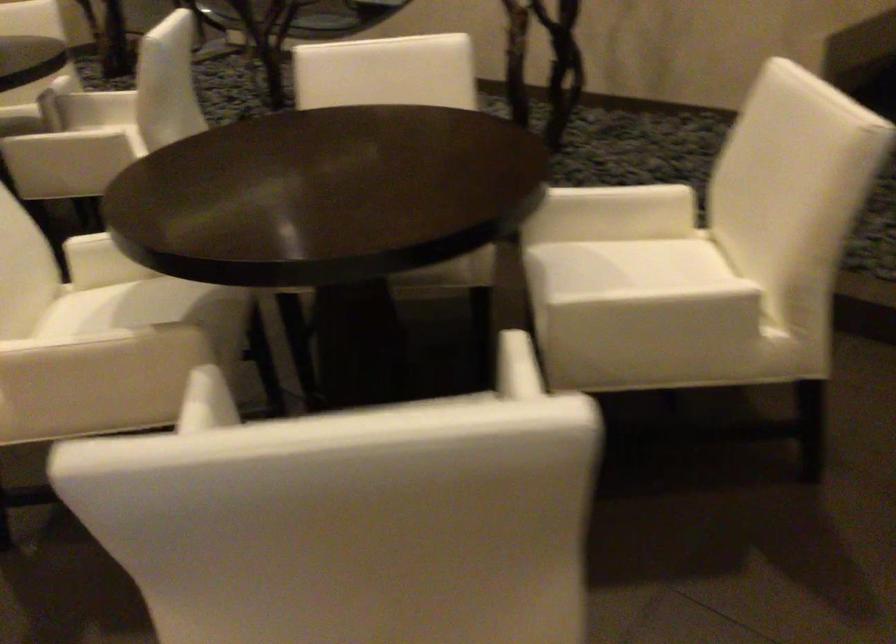
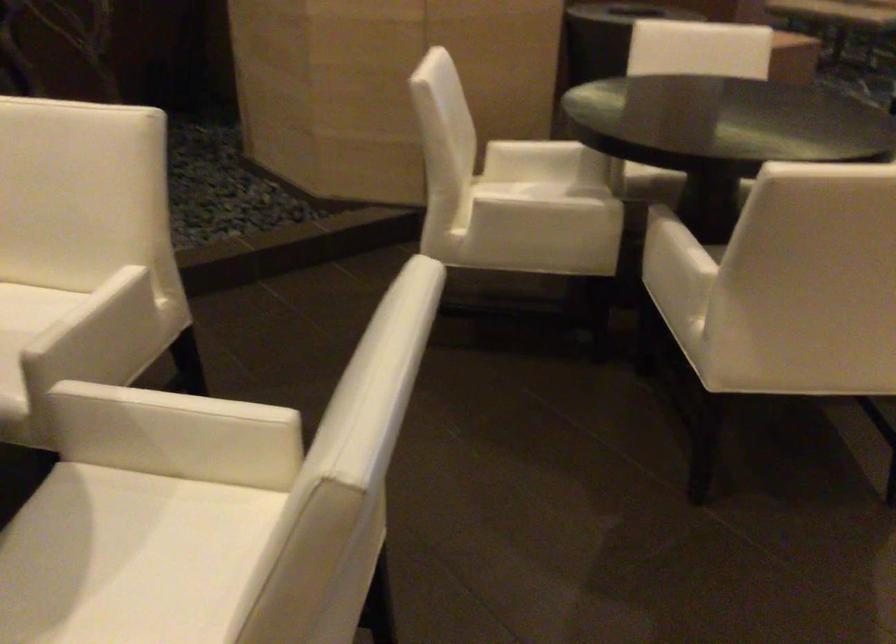
Where in the second image is the point corresponding to (647,315) from the first image?

(102, 328)